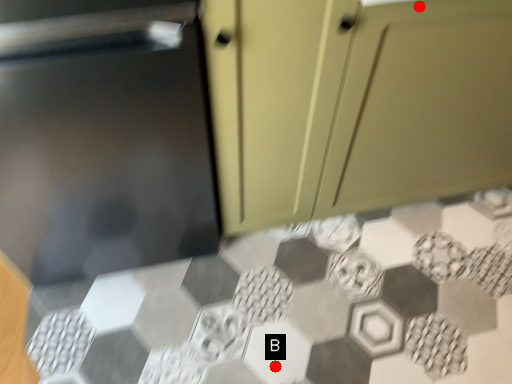
Question: Two points are circled on the image, labeled by A and B beside each circle. Which point is closer to the camera?

Choices:
 (A) A is closer
 (B) B is closer

Answer: (A)